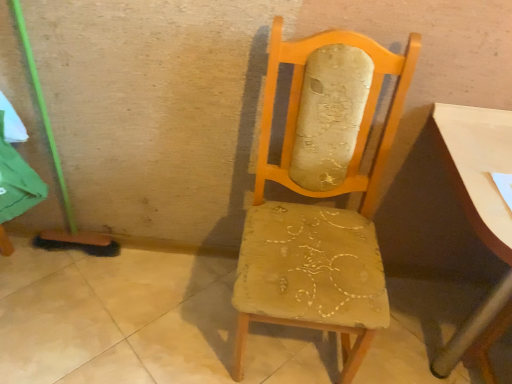
This screenshot has width=512, height=384. What do you see at coordinates (478, 220) in the screenshot?
I see `smooth white table at right` at bounding box center [478, 220].

Where is `smooth white table at right`? The height and width of the screenshot is (384, 512). smooth white table at right is located at coordinates click(x=478, y=220).

What do you see at coordinates (321, 194) in the screenshot? Image resolution: width=512 pixels, height=384 pixels. I see `wooden upholstered chair at center` at bounding box center [321, 194].

Find the location of a particular element. wooden upholstered chair at center is located at coordinates (321, 194).

This screenshot has height=384, width=512. I want to click on smooth white table at right, so click(478, 220).

Which object is positioned more to the right, smooth white table at right or wooden upholstered chair at center?

From the viewer's perspective, smooth white table at right appears more on the right side.

Considering their positions, is smooth white table at right located in front of or behind wooden upholstered chair at center?

Visually, smooth white table at right is located behind wooden upholstered chair at center.

Between point (502, 136) and point (374, 186), which one is positioned in front?

The point (502, 136) is closer.

From the image's perspective, is smooth white table at right under wooden upholstered chair at center?

Yes, from the image's perspective, smooth white table at right is below wooden upholstered chair at center.

From a real-world perspective, is smooth white table at right located beneath wooden upholstered chair at center?

Yes, from a real-world perspective, smooth white table at right is beneath wooden upholstered chair at center.

Consider the image. Considering the sizes of objects smooth white table at right and wooden upholstered chair at center in the image provided, who is wider, smooth white table at right or wooden upholstered chair at center?

smooth white table at right is wider.

Is smooth white table at right shorter than wooden upholstered chair at center?

Yes, smooth white table at right is shorter than wooden upholstered chair at center.

From the picture: Does smooth white table at right have a larger size compared to wooden upholstered chair at center?

Correct, smooth white table at right is larger in size than wooden upholstered chair at center.

Looking at this image, is smooth white table at right completely or partially outside of wooden upholstered chair at center?

Yes, smooth white table at right is not within wooden upholstered chair at center.

From the picture: Are smooth white table at right and wooden upholstered chair at center located far from each other?

smooth white table at right is near wooden upholstered chair at center, not far away.

Could you tell me if smooth white table at right is turned towards wooden upholstered chair at center?

No, smooth white table at right does not turn towards wooden upholstered chair at center.

What's the angular difference between smooth white table at right and wooden upholstered chair at center's facing directions?

The angular difference between smooth white table at right and wooden upholstered chair at center is 2.9 degrees.

The width and height of the screenshot is (512, 384). Identify the location of table that appears below the wooden upholstered chair at center (from a real-world perspective). (478, 220).

Is wooden upholstered chair at center to the right of smooth white table at right from the viewer's perspective?

Incorrect, wooden upholstered chair at center is not on the right side of smooth white table at right.

Considering the positions of objects wooden upholstered chair at center and smooth white table at right in the image provided, who is behind, wooden upholstered chair at center or smooth white table at right?

smooth white table at right is behind.

Does point (348, 53) appear closer or farther from the camera than point (474, 222)?

Clearly, point (348, 53) is more distant from the camera than point (474, 222).

From the image's perspective, does wooden upholstered chair at center appear higher than smooth white table at right?

Yes.

From a real-world perspective, is wooden upholstered chair at center on top of smooth white table at right?

Yes, from a real-world perspective, wooden upholstered chair at center is above smooth white table at right.

Which object is thinner, wooden upholstered chair at center or smooth white table at right?

Thinner between the two is wooden upholstered chair at center.

Does wooden upholstered chair at center have a greater height compared to smooth white table at right?

Yes, wooden upholstered chair at center is taller than smooth white table at right.

Considering the relative sizes of wooden upholstered chair at center and smooth white table at right in the image provided, is wooden upholstered chair at center bigger than smooth white table at right?

Actually, wooden upholstered chair at center might be smaller than smooth white table at right.

Is wooden upholstered chair at center located outside smooth white table at right?

Indeed, wooden upholstered chair at center is completely outside smooth white table at right.

Is wooden upholstered chair at center far away from smooth white table at right?

No.

Could you tell me if wooden upholstered chair at center is facing smooth white table at right?

No, wooden upholstered chair at center is not turned towards smooth white table at right.

How different are the orientations of wooden upholstered chair at center and smooth white table at right in degrees?

wooden upholstered chair at center and smooth white table at right are facing 2.9 degrees away from each other.

The width and height of the screenshot is (512, 384). Identify the location of chair that appears above the smooth white table at right (from a real-world perspective). (321, 194).

Where is `table that appears on the right of wooden upholstered chair at center`? This screenshot has width=512, height=384. table that appears on the right of wooden upholstered chair at center is located at coordinates point(478,220).

What are the coordinates of `chair on the left of smooth white table at right` in the screenshot? It's located at pyautogui.click(x=321, y=194).